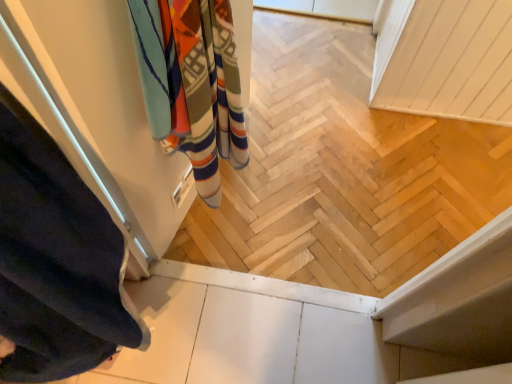
Question: Can we say multicolored woven towel at upper left lies outside dark blue fabric at left?

Choices:
 (A) yes
 (B) no

Answer: (A)

Question: Is multicolored woven towel at upper left shorter than dark blue fabric at left?

Choices:
 (A) no
 (B) yes

Answer: (B)

Question: Is multicolored woven towel at upper left wider than dark blue fabric at left?

Choices:
 (A) yes
 (B) no

Answer: (B)

Question: From a real-world perspective, is multicolored woven towel at upper left over dark blue fabric at left?

Choices:
 (A) yes
 (B) no

Answer: (B)

Question: Is dark blue fabric at left located within multicolored woven towel at upper left?

Choices:
 (A) no
 (B) yes

Answer: (A)

Question: Is multicolored woven towel at upper left taller than dark blue fabric at left?

Choices:
 (A) yes
 (B) no

Answer: (B)

Question: Does dark blue fabric at left have a greater height compared to multicolored woven towel at upper left?

Choices:
 (A) yes
 (B) no

Answer: (A)

Question: Can you confirm if dark blue fabric at left is positioned to the left of multicolored woven towel at upper left?

Choices:
 (A) yes
 (B) no

Answer: (A)

Question: Are dark blue fabric at left and multicolored woven towel at upper left located far from each other?

Choices:
 (A) yes
 (B) no

Answer: (B)

Question: Does dark blue fabric at left have a smaller size compared to multicolored woven towel at upper left?

Choices:
 (A) yes
 (B) no

Answer: (A)

Question: Is dark blue fabric at left looking in the opposite direction of multicolored woven towel at upper left?

Choices:
 (A) no
 (B) yes

Answer: (A)

Question: Is dark blue fabric at left to the right of multicolored woven towel at upper left from the viewer's perspective?

Choices:
 (A) yes
 (B) no

Answer: (B)

Question: Is point 161,91 closer or farther from the camera than point 15,218?

Choices:
 (A) farther
 (B) closer

Answer: (A)